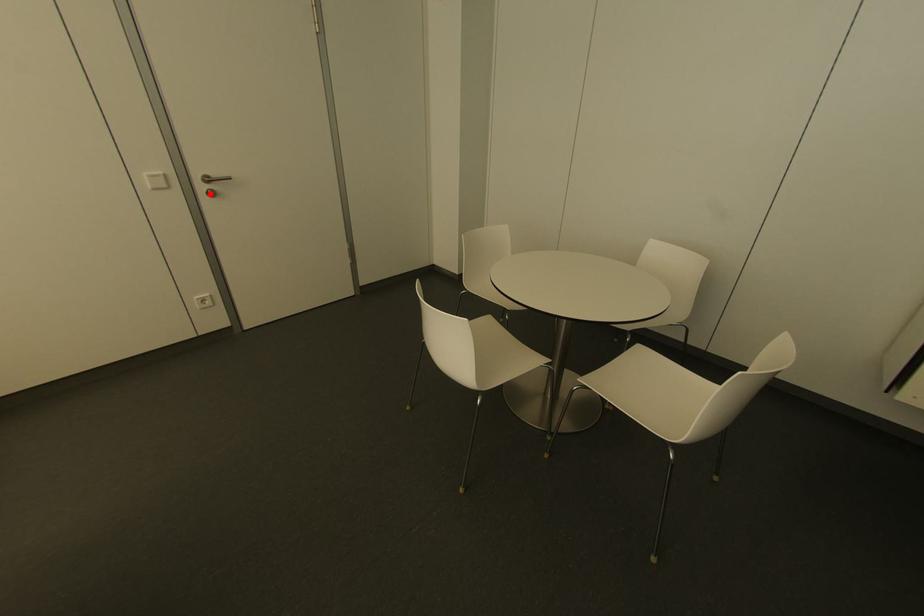
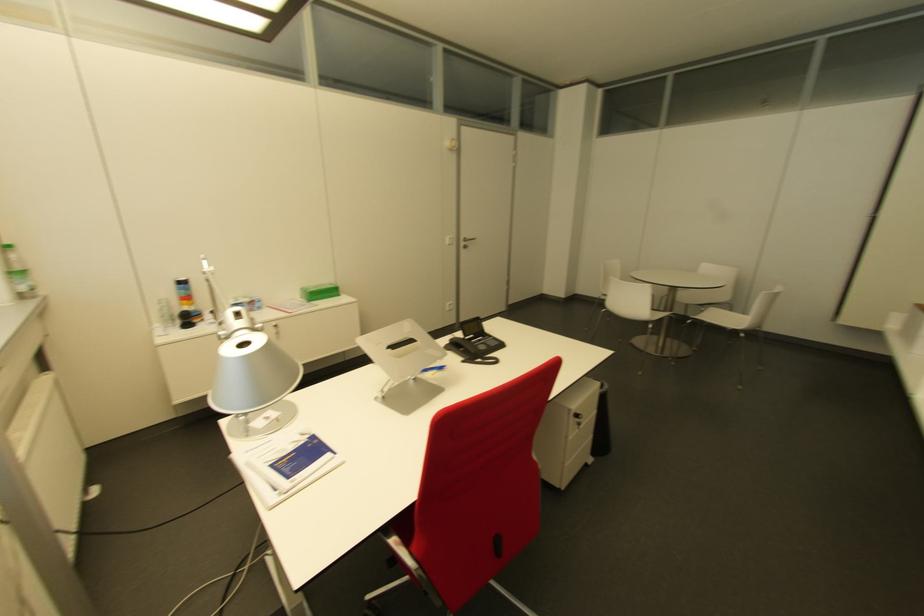
Find the pixel in the second image that matches the highlighted location in the first image.

(463, 246)